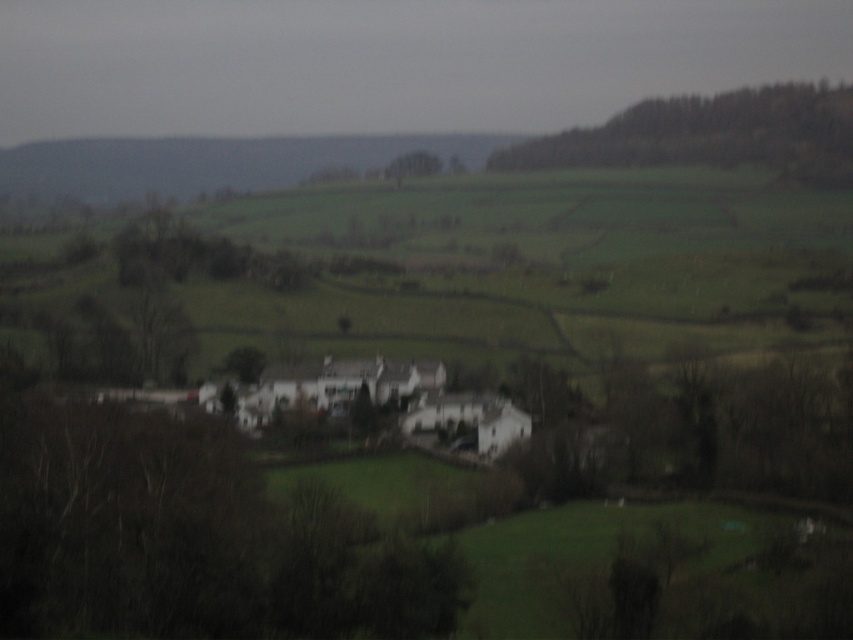
Does green leafy tree at lower left have a greater width compared to green leafy tree at center?

Yes.

Is green leafy tree at lower left to the right of green leafy tree at center from the viewer's perspective?

Incorrect, green leafy tree at lower left is not on the right side of green leafy tree at center.

Describe the element at coordinates (189, 538) in the screenshot. I see `green leafy tree at lower left` at that location.

Where is `green leafy tree at lower left`? The width and height of the screenshot is (853, 640). green leafy tree at lower left is located at coordinates (189, 538).

Is green grassy hillside at center smaller than green leafy tree at center?

No.

Is point (641, 186) farther from camera compared to point (428, 166)?

No.

Find the location of a particular element. The height and width of the screenshot is (640, 853). green grassy hillside at center is located at coordinates (526, 266).

Who is positioned more to the left, green grassy hillside at center or green leafy tree at lower left?

green leafy tree at lower left is more to the left.

Which of these two, green grassy hillside at center or green leafy tree at lower left, stands taller?

With more height is green grassy hillside at center.

Identify the location of green grassy hillside at center. Image resolution: width=853 pixels, height=640 pixels. (526, 266).

Find the location of a particular element. The height and width of the screenshot is (640, 853). green grassy hillside at center is located at coordinates (526, 266).